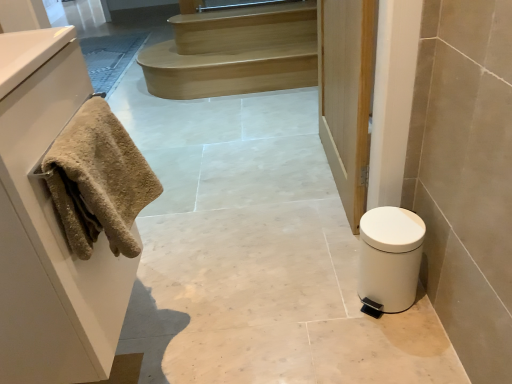
Question: Is white matte trash can at lower right closer to camera compared to beige textured towel at left?

Choices:
 (A) yes
 (B) no

Answer: (B)

Question: Considering the relative sizes of white matte trash can at lower right and beige textured towel at left in the image provided, is white matte trash can at lower right wider than beige textured towel at left?

Choices:
 (A) no
 (B) yes

Answer: (A)

Question: Is white matte trash can at lower right located outside beige textured towel at left?

Choices:
 (A) no
 (B) yes

Answer: (B)

Question: From the image's perspective, is white matte trash can at lower right on beige textured towel at left?

Choices:
 (A) no
 (B) yes

Answer: (A)

Question: Is white matte trash can at lower right bigger than beige textured towel at left?

Choices:
 (A) no
 (B) yes

Answer: (A)

Question: In terms of width, does beige textured towel at left look wider or thinner when compared to white matte trash can at lower right?

Choices:
 (A) thin
 (B) wide

Answer: (B)

Question: From the image's perspective, is beige textured towel at left above or below white matte trash can at lower right?

Choices:
 (A) above
 (B) below

Answer: (A)

Question: Do you think beige textured towel at left is within white matte trash can at lower right, or outside of it?

Choices:
 (A) inside
 (B) outside

Answer: (B)

Question: From a real-world perspective, is beige textured towel at left physically located above or below white matte trash can at lower right?

Choices:
 (A) above
 (B) below

Answer: (A)

Question: Is white matte trash can at lower right inside or outside of wooden door at center?

Choices:
 (A) inside
 (B) outside

Answer: (B)

Question: Considering the positions of white matte trash can at lower right and wooden door at center in the image, is white matte trash can at lower right taller or shorter than wooden door at center?

Choices:
 (A) short
 (B) tall

Answer: (A)

Question: Considering the relative positions of white matte trash can at lower right and wooden door at center in the image provided, is white matte trash can at lower right to the left or to the right of wooden door at center?

Choices:
 (A) right
 (B) left

Answer: (A)

Question: Is white matte trash can at lower right bigger or smaller than wooden door at center?

Choices:
 (A) big
 (B) small

Answer: (B)

Question: From a real-world perspective, is beige textured towel at left physically located above or below wooden door at center?

Choices:
 (A) below
 (B) above

Answer: (B)

Question: Considering the positions of point click(45, 349) and point click(373, 36), is point click(45, 349) closer or farther from the camera than point click(373, 36)?

Choices:
 (A) farther
 (B) closer

Answer: (B)